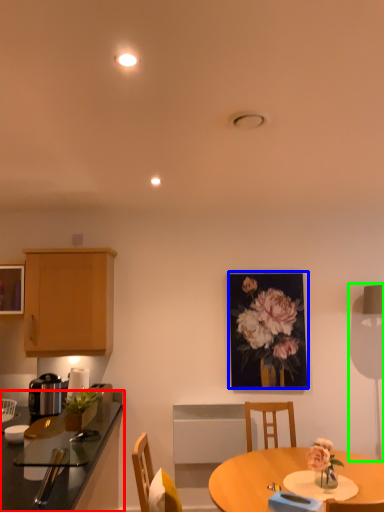
Question: Considering the real-world distances, which object is farthest from countertop (highlighted by a red box)? picture frame (highlighted by a blue box) or table lamp (highlighted by a green box)?

Choices:
 (A) picture frame
 (B) table lamp

Answer: (B)